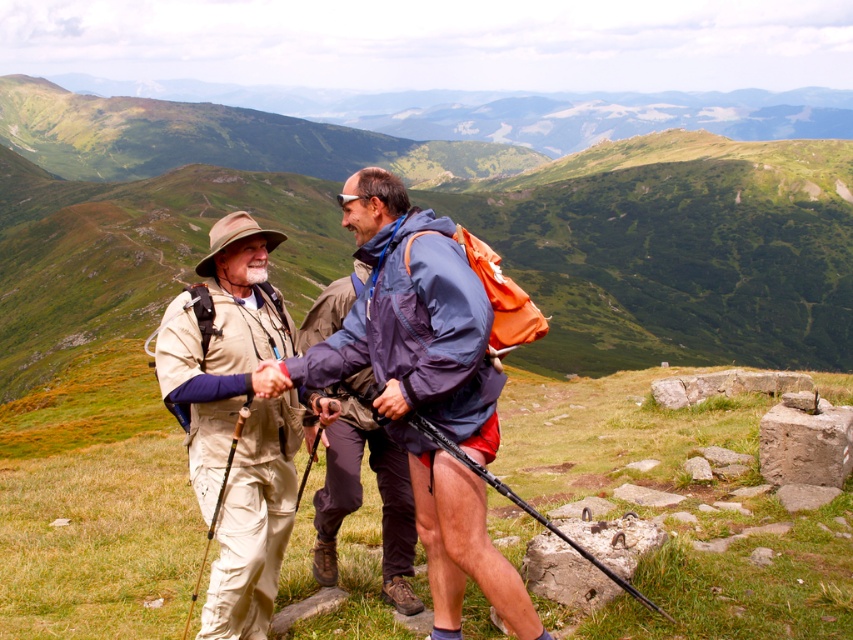
From the picture: You are a photographer trying to capture a photo of the khaki cotton pants at center and the beige fabric hat at center. If your camera has a depth of field that can focus on objects within 36 inches of each other, will both items be in focus?

The khaki cotton pants at center and the beige fabric hat at center are 38.51 inches apart. Since the depth of field can only focus on objects within 36 inches of each other, the two items are slightly out of the required range. Therefore, both items might not be in focus simultaneously.

You are a hiker who just reached the summit. You notice the beige fabric hat at center and the matte blue jacket at center. Which object is closer to you?

The beige fabric hat at center is closer to you because it is in front of the matte blue jacket at center.

You are a hiker trying to determine the order of the two hikers from your perspective. Which object is closer to you between the khaki cotton pants at center and the matte blue jacket at center?

The khaki cotton pants at center is in front of the matte blue jacket at center, so the khaki cotton pants at center is closer to you.